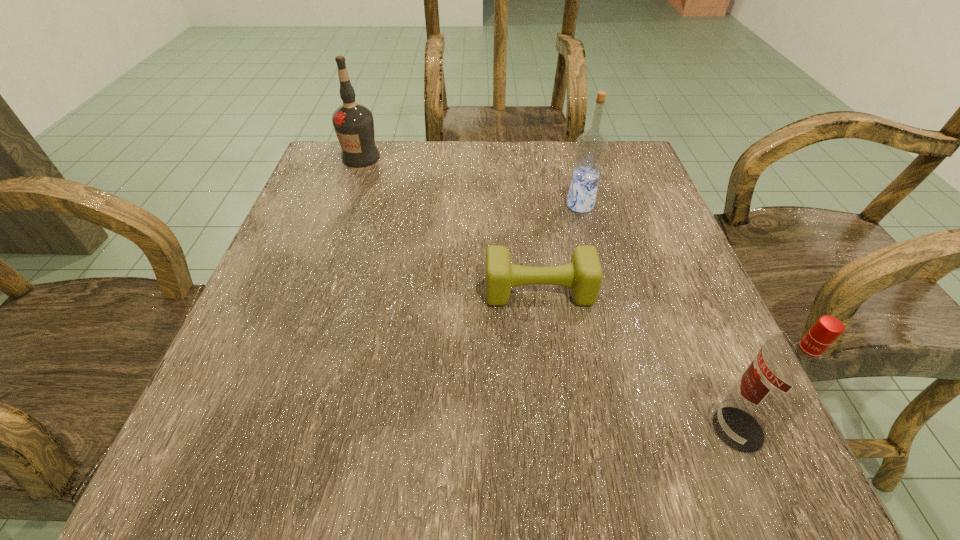
Where is `empty space between the second vodka from left to right and the rightmost object`? empty space between the second vodka from left to right and the rightmost object is located at coordinates (660, 317).

The height and width of the screenshot is (540, 960). What are the coordinates of `empty space between the farthest object and the shortest object` in the screenshot? It's located at (450, 225).

This screenshot has width=960, height=540. Find the location of `vacant region between the farthest vodka and the rightmost object`. vacant region between the farthest vodka and the rightmost object is located at coordinates (549, 293).

Locate an element on the screen. vacant area between the shortest object and the second vodka from left to right is located at coordinates (560, 248).

Find the location of a particular element. Image resolution: width=960 pixels, height=540 pixels. object that is the second closest one to the farthest object is located at coordinates (591, 147).

Select which object is the second closest to the leftmost object. Please provide its 2D coordinates. Your answer should be formatted as a tuple, i.e. [(x, y)], where the tuple contains the x and y coordinates of a point satisfying the conditions above.

[(591, 147)]

Locate which vodka ranks in proximity to the second nearest vodka. Please provide its 2D coordinates. Your answer should be formatted as a tuple, i.e. [(x, y)], where the tuple contains the x and y coordinates of a point satisfying the conditions above.

[(789, 373)]

This screenshot has height=540, width=960. Identify the location of vodka that is the closest one to the leftmost vodka. (591, 147).

Where is `free space that satisfies the following two spatial constraints: 1. on the front label of the second farthest object; 2. on the left side of the leftmost vodka`? Image resolution: width=960 pixels, height=540 pixels. free space that satisfies the following two spatial constraints: 1. on the front label of the second farthest object; 2. on the left side of the leftmost vodka is located at coordinates (344, 205).

The image size is (960, 540). Identify the location of vacant space that satisfies the following two spatial constraints: 1. on the front label of the farthest object; 2. on the right side of the second nearest object. (314, 292).